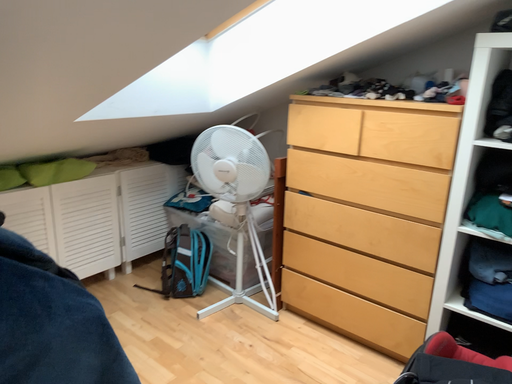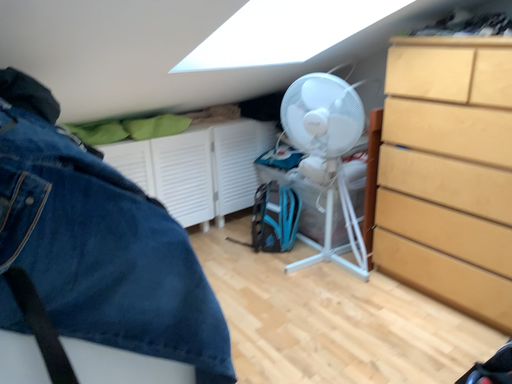
Question: Which way did the camera rotate in the video?

Choices:
 (A) rotated left
 (B) rotated right

Answer: (A)